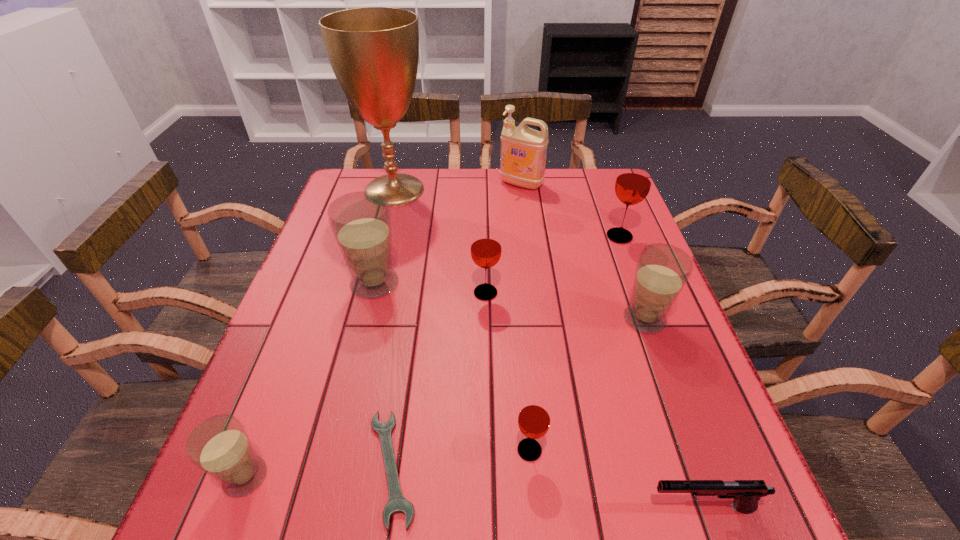
Select which blue glass appears as the closest to the rightmost blue glass. Please provide its 2D coordinates. Your answer should be formatted as a tuple, i.e. [(x, y)], where the tuple contains the x and y coordinates of a point satisfying the conditions above.

[(361, 221)]

You are a GUI agent. You are given a task and a screenshot of the screen. Output one action in this format:
    pyautogui.click(x=<x>, y=<y>)
    Task: Click on the vacant space that satisfies the following two spatial constraints: 1. on the front side of the beige detergent; 2. on the left side of the rightmost blue glass
    The image size is (960, 540).
    Given the screenshot: What is the action you would take?
    pyautogui.click(x=539, y=319)

Where is `free space that satisfies the following two spatial constraints: 1. on the back side of the second red glass from right to left; 2. on the right side of the leftmost blue glass`? free space that satisfies the following two spatial constraints: 1. on the back side of the second red glass from right to left; 2. on the right side of the leftmost blue glass is located at coordinates (255, 450).